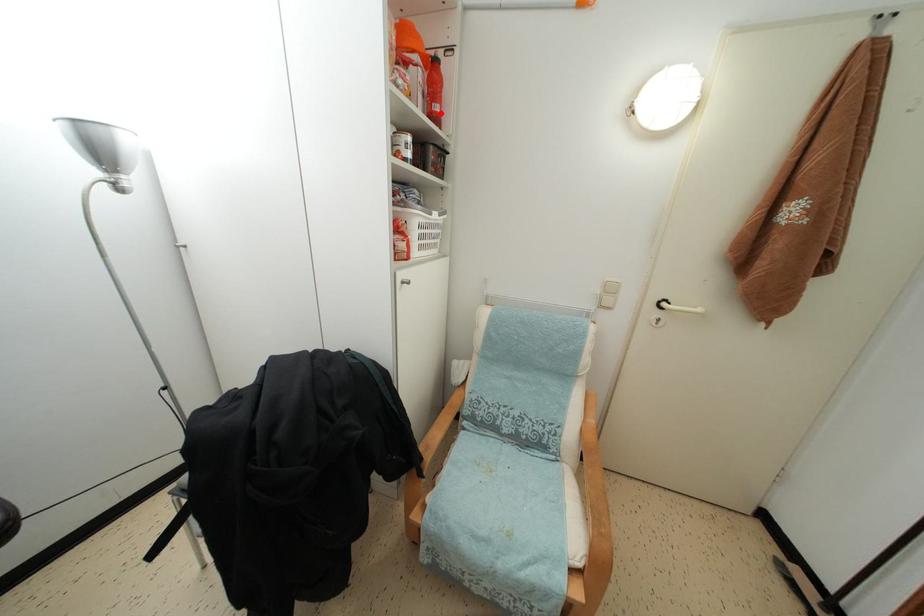
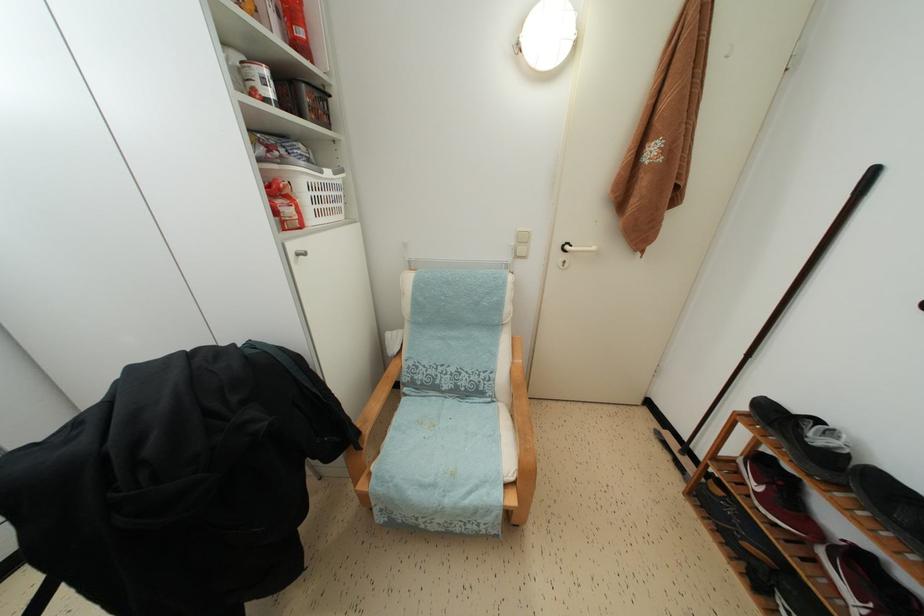
In the second image, find the point that corresponds to the highlighted location in the first image.

(305, 38)